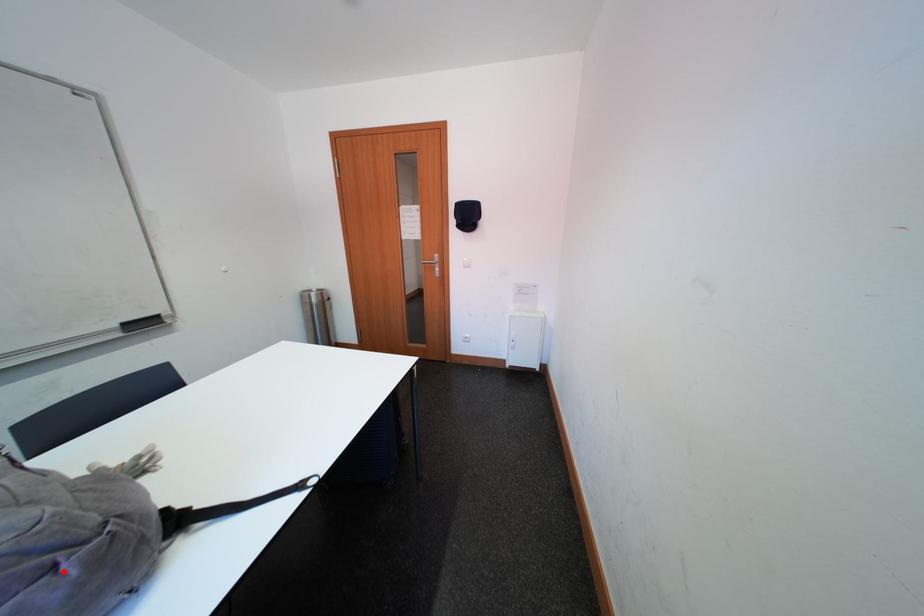
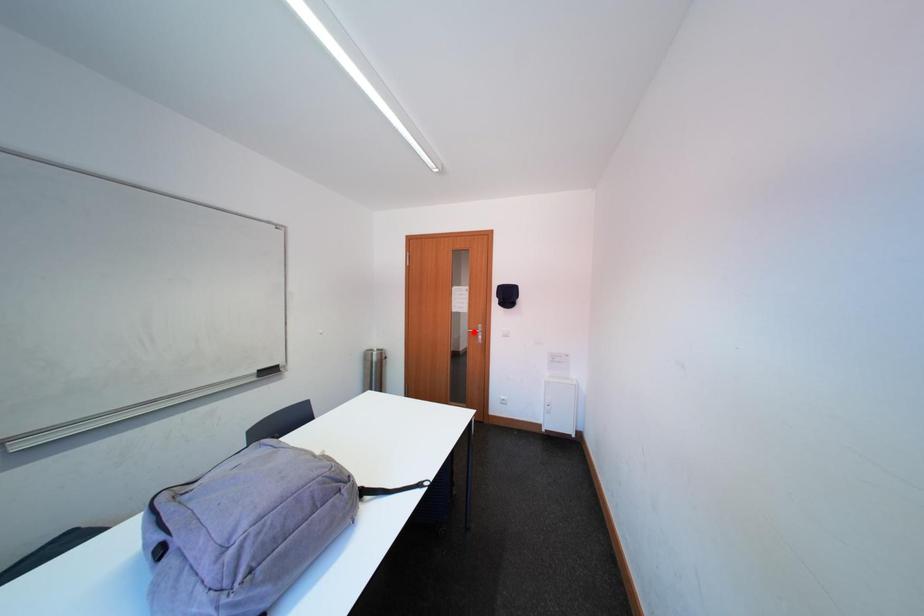
I am providing you with two images of the same scene from different viewpoints. A red point is marked on the first image and another point is marked on the second image. Is the red point in image1 aligned with the point shown in image2?

No